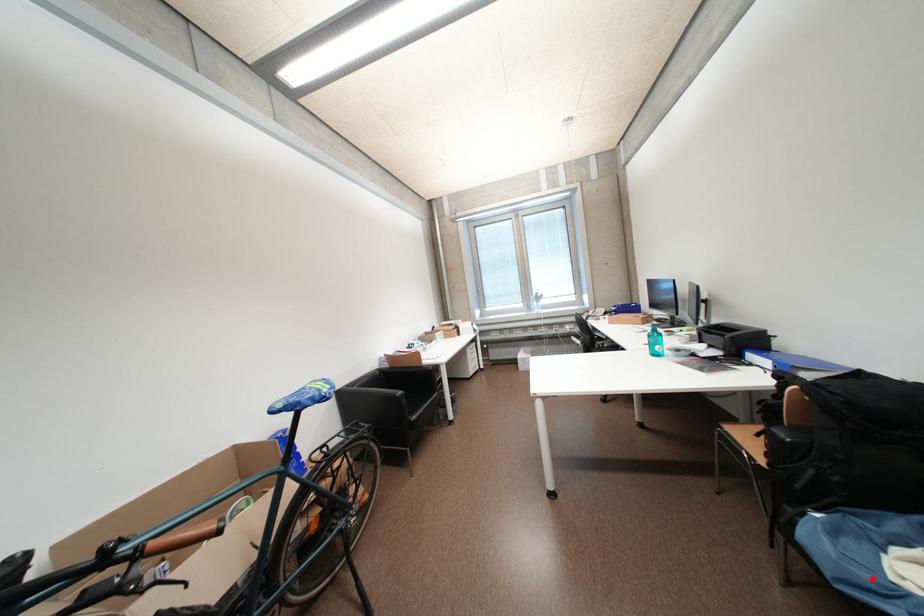
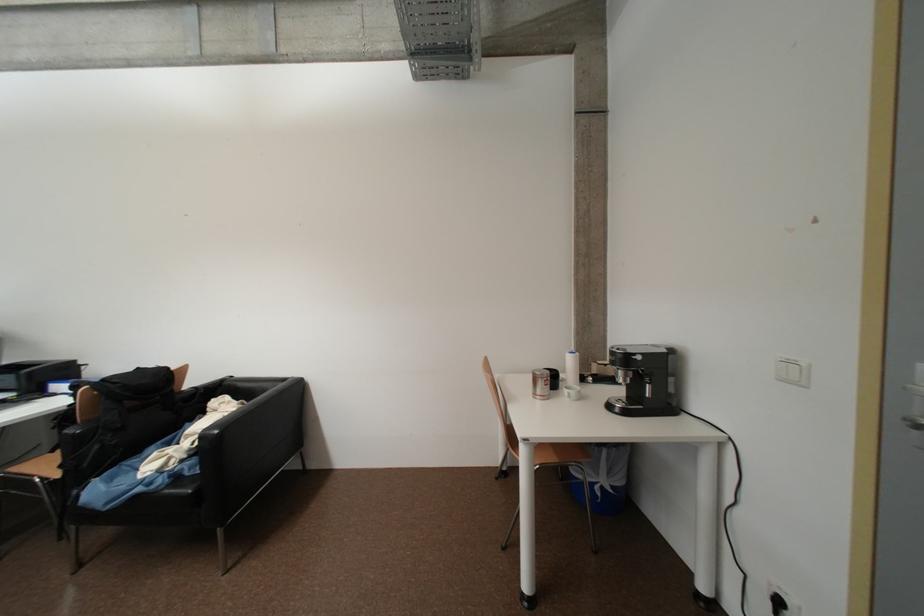
Find the pixel in the second image that matches the highlighted location in the first image.

(130, 488)